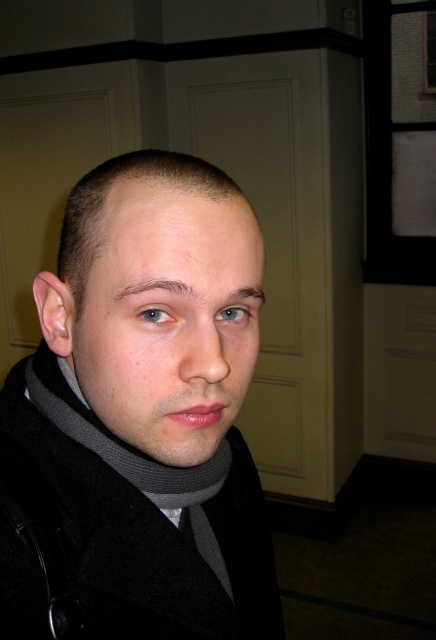
You are helping organize a clothing store and need to arrange two gray scarves on a display rack. The matte gray scarf at center and the gray wool scarf at center are both available. According to the image, which scarf should be placed higher on the rack?

The matte gray scarf at center should be placed higher on the rack since it is positioned above the gray wool scarf at center in the image.

You are a tailor who needs to determine if the matte gray scarf at center can be folded and placed inside the black woolen coat at center without any part of the scarf being visible. Based on their sizes, what would you advise?

The black woolen coat at center is wider than the matte gray scarf at center, so the scarf can be folded and placed inside the coat without any part being visible.

You are a fashion designer who wants to create a matching accessory for the black woolen coat at center and the gray wool scarf at center. Which item should you consider resizing to ensure compatibility with the other?

The gray wool scarf at center should be resized since the black woolen coat at center is bigger, so the scarf can be made larger to match the scale of the coat.